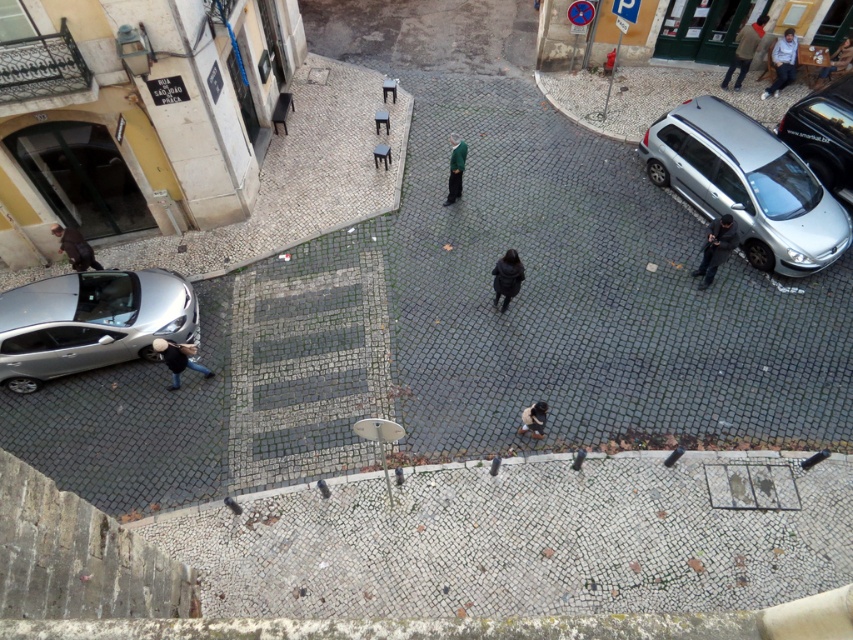
You are standing on the balcony looking down at the square. There are two points marked on the ground below. The first point is at coordinates point [519,273] and the second point is at point [456,179]. Which point is closer to your current position?

Point [519,273] is closer to the camera than point [456,179], so the first point is closer to your current position.

From the picture: You are standing on the balcony and want to see both the dark gray fabric jacket at lower right and the dark brown leather jacket at left. Which jacket is closer to you?

The dark gray fabric jacket at lower right is closer to you because it is in front of the dark brown leather jacket at left.

You are standing on a balcony overlooking the square. You see a silver metallic car at upper right. If you want to throw a small ball to someone standing near the car, and the ball can travel up to 15 meters, will it reach them?

The silver metallic car at upper right is 13.43 meters away from the viewer. Since the ball can travel up to 15 meters, it will reach them.